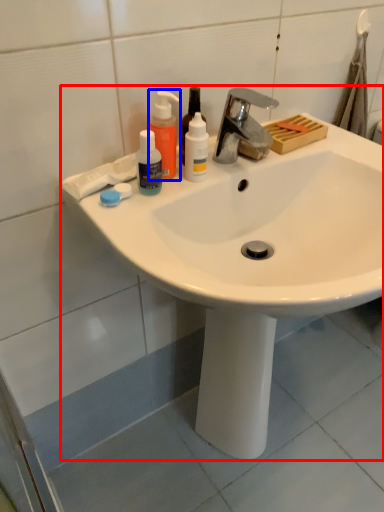
Question: Which object is closer to the camera taking this photo, sink (highlighted by a red box) or cleaning product (highlighted by a blue box)?

Choices:
 (A) sink
 (B) cleaning product

Answer: (A)